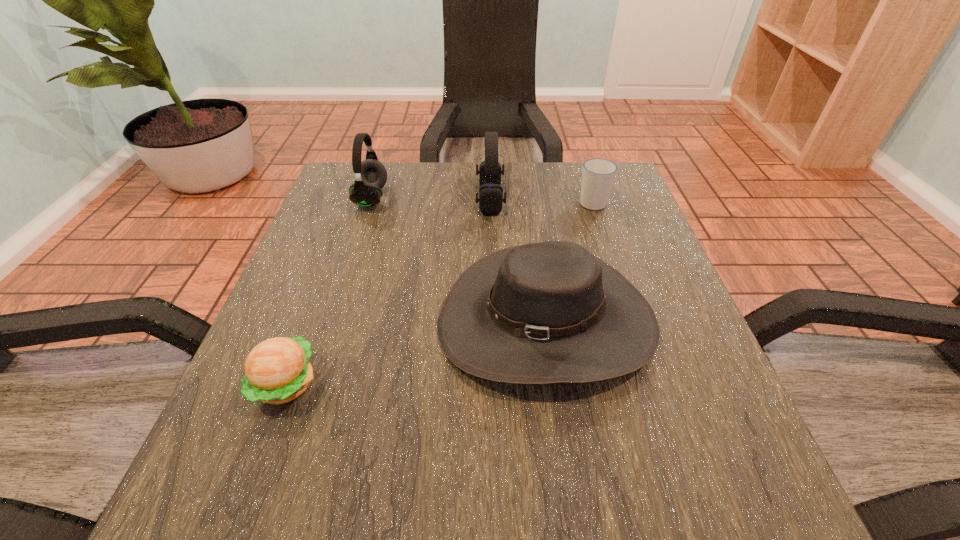
Locate an element on the screen. vacant area at the far edge is located at coordinates (401, 175).

In order to click on vacant region at the near edge of the desktop in this screenshot , I will do `click(389, 474)`.

At what (x,y) coordinates should I click in order to perform the action: click on blank space at the left edge of the desktop. Please return your answer as a coordinate pair (x, y). This screenshot has width=960, height=540. Looking at the image, I should click on (292, 266).

This screenshot has height=540, width=960. In order to click on vacant area at the right edge in this screenshot , I will do `click(583, 215)`.

Locate an element on the screen. This screenshot has width=960, height=540. free region at the far left corner of the desktop is located at coordinates (391, 179).

The image size is (960, 540). Identify the location of free space at the near left corner of the desktop. (252, 523).

This screenshot has height=540, width=960. I want to click on vacant space at the far right corner, so click(620, 194).

This screenshot has width=960, height=540. In order to click on vacant area that lies between the right headset and the shortest object in this screenshot , I will do `click(388, 291)`.

You are a GUI agent. You are given a task and a screenshot of the screen. Output one action in this format:
    pyautogui.click(x=<x>, y=<y>)
    Task: Click on the vacant space that is in between the cowboy hat and the left headset
    This screenshot has height=540, width=960.
    Given the screenshot: What is the action you would take?
    pyautogui.click(x=459, y=260)

Find the location of a particular element. Image resolution: width=960 pixels, height=540 pixels. free space that is in between the hamburger and the cup is located at coordinates (439, 293).